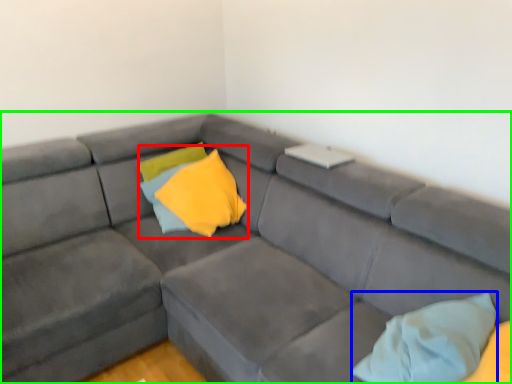
Question: Estimate the real-world distances between objects in this image. Which object is closer to pillow (highlighted by a red box), pillow (highlighted by a blue box) or studio couch (highlighted by a green box)?

Choices:
 (A) pillow
 (B) studio couch

Answer: (B)